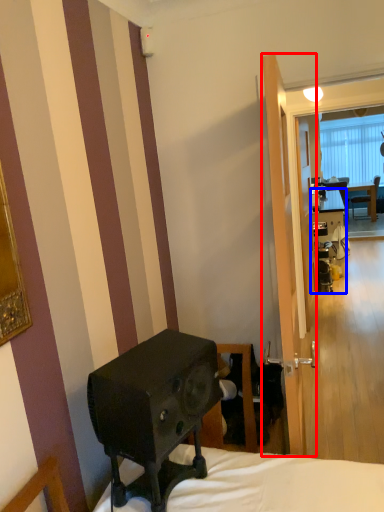
Question: Which object is closer to the camera taking this photo, screen door (highlighted by a red box) or desk (highlighted by a blue box)?

Choices:
 (A) screen door
 (B) desk

Answer: (A)